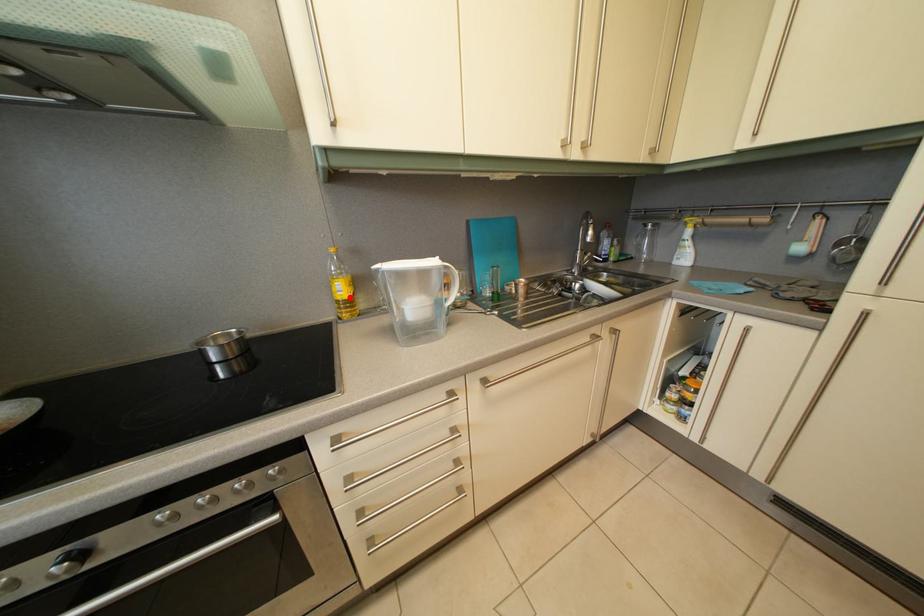
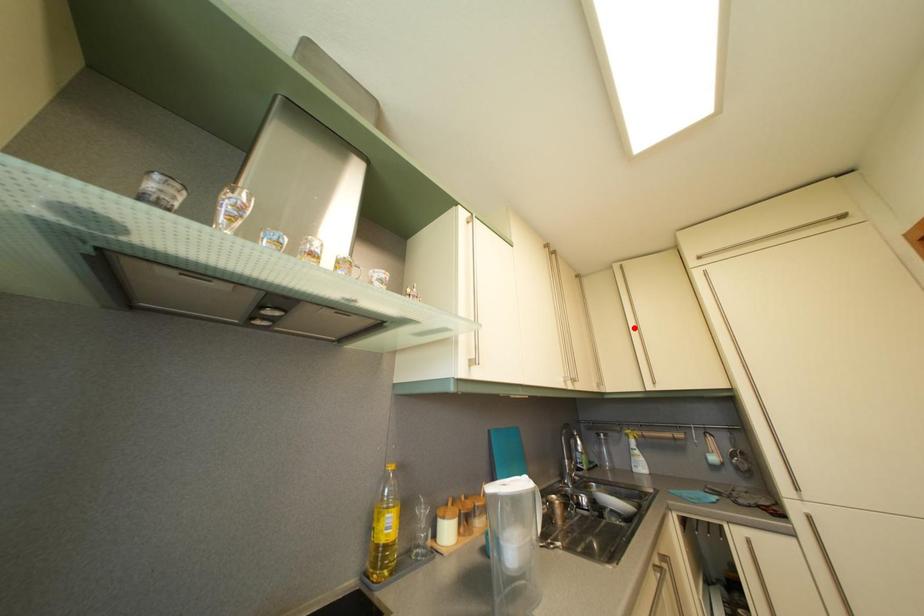
I am providing you with two images of the same scene from different viewpoints. A red point is marked on the first image and another point is marked on the second image. Are the points marked in image1 and image2 representing the same 3D position?

No